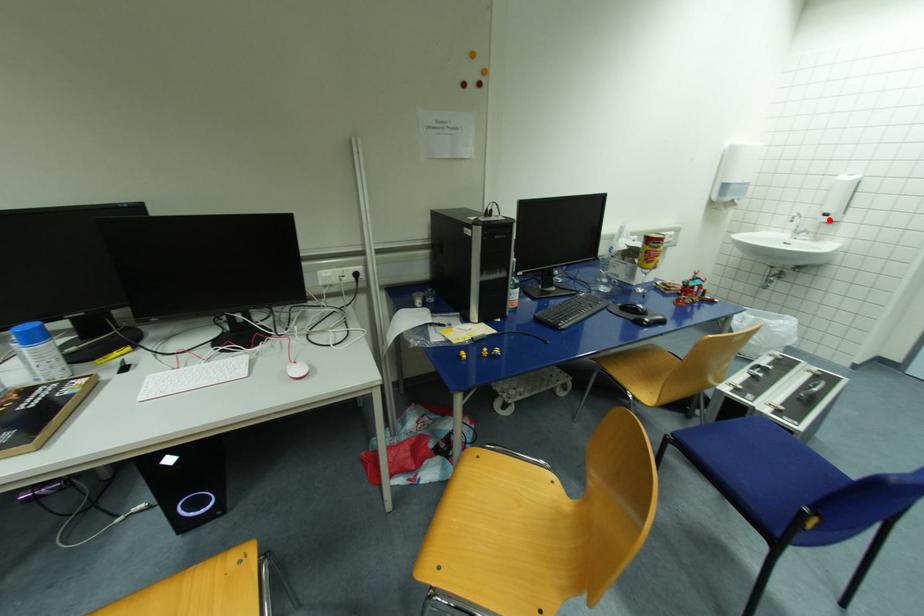
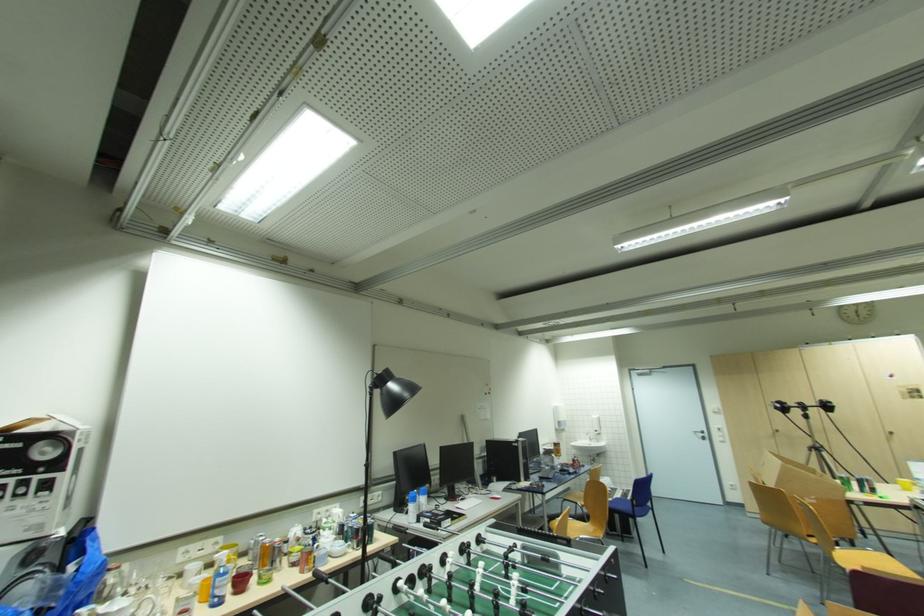
Question: A red point is marked in image1. In image2, is the corresponding 3D point closer to the camera or farther? Reply with the corresponding letter.

Choices:
 (A) The corresponding 3D point is closer.
 (B) The corresponding 3D point is farther.

Answer: (B)